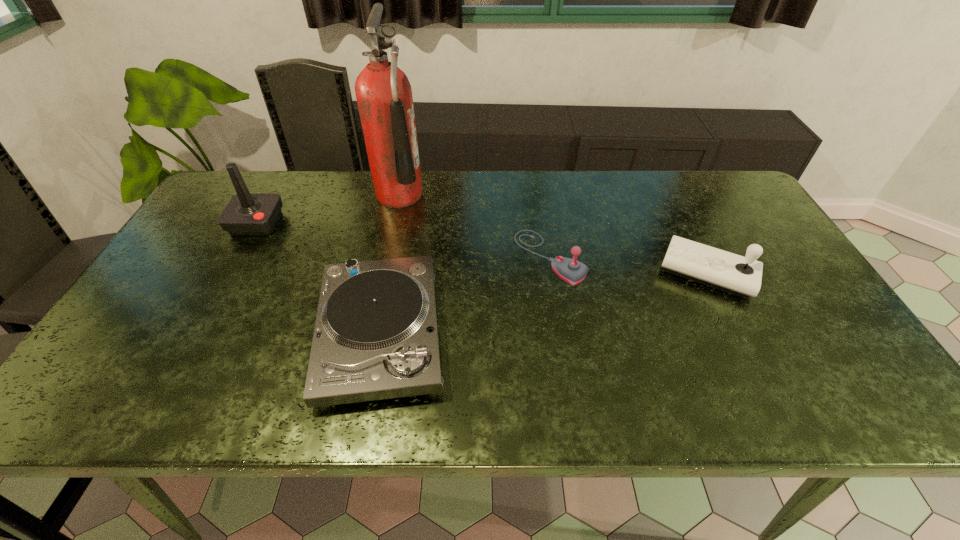
At what (x,y) coordinates should I click in order to perform the action: click on vacant space at the near edge. Please return your answer as a coordinate pair (x, y). The image size is (960, 540). Looking at the image, I should click on (603, 409).

Where is `vacant space at the left edge`? vacant space at the left edge is located at coordinates (203, 251).

Find the location of `free location at the right edge`. free location at the right edge is located at coordinates (727, 250).

Locate an element on the screen. blank space at the far right corner is located at coordinates (725, 198).

This screenshot has height=540, width=960. I want to click on vacant area that lies between the tallest object and the second tallest joystick, so click(x=554, y=234).

The image size is (960, 540). What are the coordinates of `vacant space in between the leftmost object and the third shortest object` in the screenshot? It's located at (482, 248).

This screenshot has height=540, width=960. I want to click on free space between the tallest object and the leftmost object, so click(328, 209).

Image resolution: width=960 pixels, height=540 pixels. I want to click on empty space that is in between the fourth object from left to right and the rightmost object, so (629, 265).

Locate an element on the screen. This screenshot has height=540, width=960. free space that is in between the record player and the second shortest joystick is located at coordinates (544, 303).

The width and height of the screenshot is (960, 540). Identify the location of free space that is in between the tallest object and the second tallest object. (328, 209).